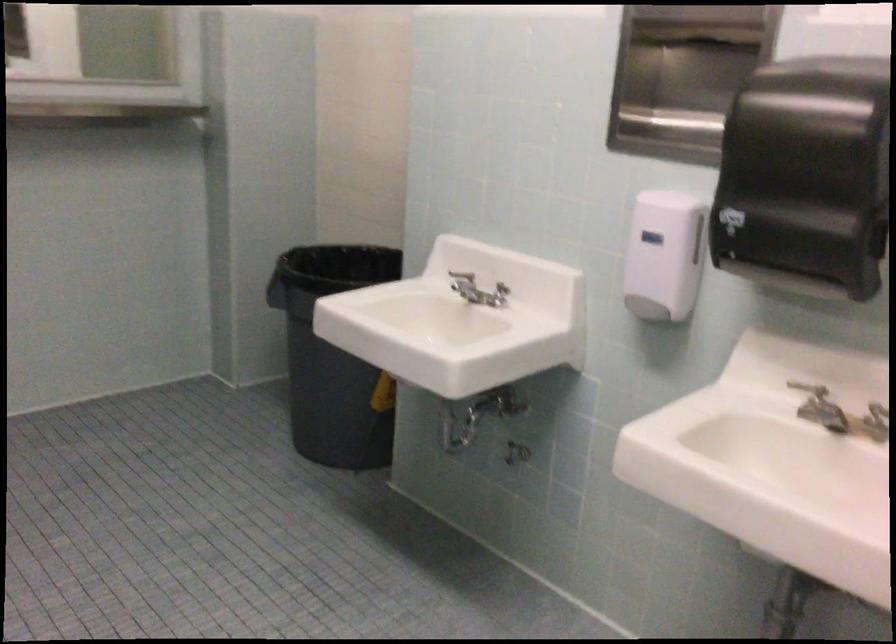
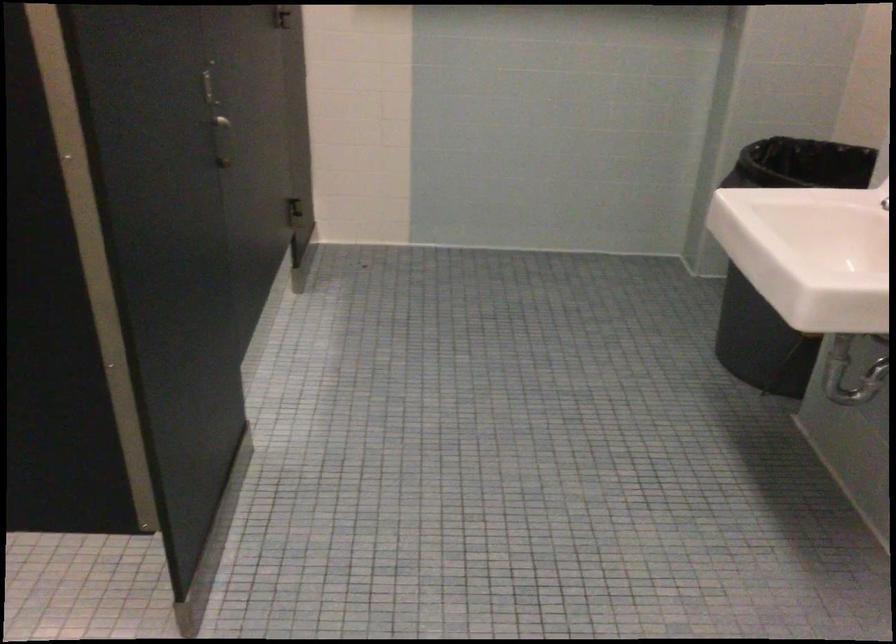
Question: The camera is either moving clockwise (left) or counter-clockwise (right) around the object. The first image is from the beginning of the video and the second image is from the end. Is the camera moving left or right when shooting the video?

Choices:
 (A) Left
 (B) Right

Answer: (B)